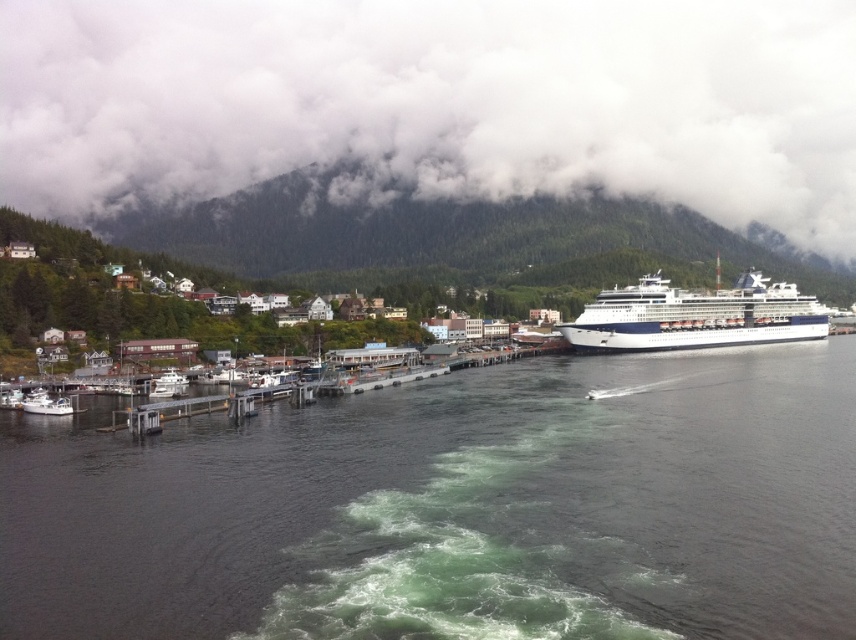
Question: Which point is closer to the camera?

Choices:
 (A) (67, 8)
 (B) (485, 323)

Answer: (B)

Question: Is clear water at dock right wider than green forested mountain at upper center?

Choices:
 (A) no
 (B) yes

Answer: (A)

Question: Among these objects, which one is farthest from the camera?

Choices:
 (A) green forested mountain at upper center
 (B) white matte boat at lower left
 (C) wooden houses at left
 (D) clear water at dock right

Answer: (A)

Question: Does green forested mountain at upper center appear over wooden houses at left?

Choices:
 (A) yes
 (B) no

Answer: (A)

Question: Which is farther from the wooden houses at left?

Choices:
 (A) white glossy cruise ship at right
 (B) white matte boat at lower left
 (C) clear water at dock right

Answer: (A)

Question: Is clear water at dock right below green forested mountain at upper center?

Choices:
 (A) yes
 (B) no

Answer: (A)